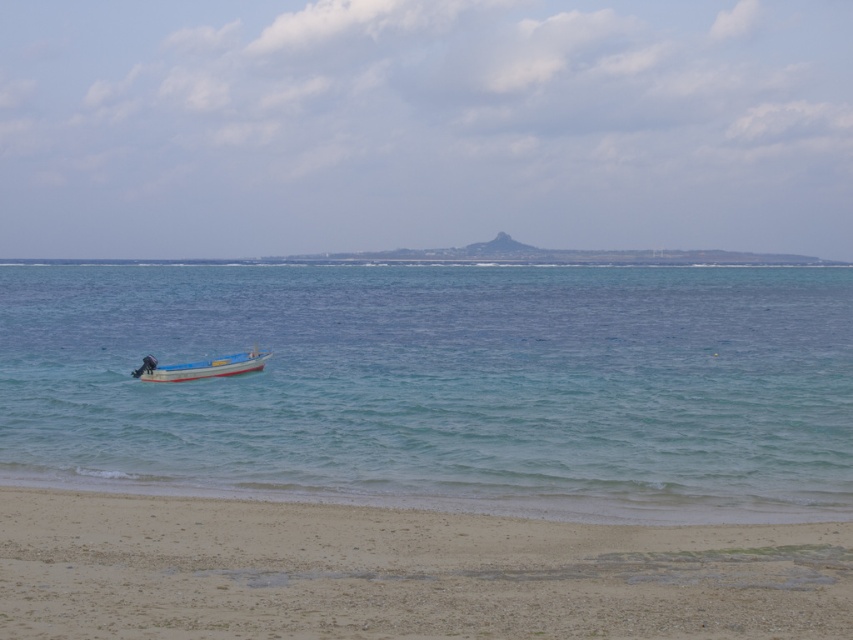
Who is more forward, (676, 506) or (137, 371)?

Point (676, 506) is more forward.

Where is `clear blue water at center`? The height and width of the screenshot is (640, 853). clear blue water at center is located at coordinates (440, 385).

Between sandy beach at lower center and dark blue fabric person at lower left, which one is positioned lower?

sandy beach at lower center is below.

Who is more distant from viewer, (837, 620) or (146, 371)?

Point (146, 371)

Describe the element at coordinates (401, 572) in the screenshot. This screenshot has width=853, height=640. I see `sandy beach at lower center` at that location.

Locate an element on the screen. sandy beach at lower center is located at coordinates (401, 572).

Does sandy beach at lower center have a smaller size compared to light blue plastic boat at center?

Yes.

Between sandy beach at lower center and light blue plastic boat at center, which one is positioned higher?

light blue plastic boat at center is higher up.

Does point (813, 628) lie behind point (180, 372)?

No, it is not.

Locate an element on the screen. sandy beach at lower center is located at coordinates (401, 572).